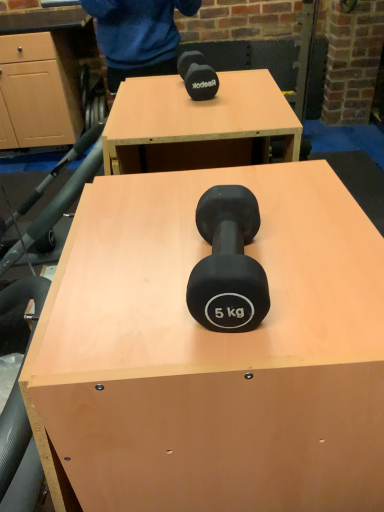
Where is `vacant space to the right of black rubber dumbbell at center`? vacant space to the right of black rubber dumbbell at center is located at coordinates point(325,261).